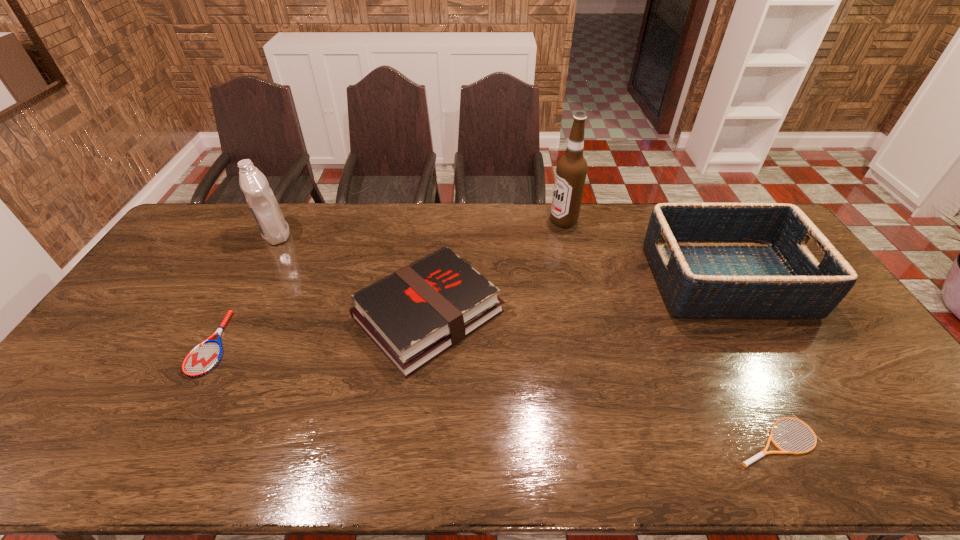
The width and height of the screenshot is (960, 540). In order to click on object present at the near edge in this screenshot , I will do `click(761, 454)`.

At what (x,y) coordinates should I click in order to perform the action: click on object that is positioned at the right edge. Please return your answer as a coordinate pair (x, y). Looking at the image, I should click on (711, 260).

This screenshot has width=960, height=540. Find the location of `free space at the far edge`. free space at the far edge is located at coordinates (297, 219).

The height and width of the screenshot is (540, 960). In the image, there is a desktop. Find the location of `vacant space at the near edge`. vacant space at the near edge is located at coordinates (270, 450).

I want to click on free region at the left edge of the desktop, so click(x=71, y=406).

This screenshot has width=960, height=540. In order to click on vacant space at the right edge in this screenshot , I will do `click(870, 370)`.

At what (x,y) coordinates should I click in order to perform the action: click on vacant space at the far left corner. Please return your answer as a coordinate pair (x, y). The height and width of the screenshot is (540, 960). Looking at the image, I should click on (231, 206).

You are a GUI agent. You are given a task and a screenshot of the screen. Output one action in this format:
    pyautogui.click(x=<x>, y=<y>)
    Task: Click on the free spot between the detergent and the tallest object
    This screenshot has width=960, height=540.
    Given the screenshot: What is the action you would take?
    pyautogui.click(x=420, y=228)

You are a GUI agent. You are given a task and a screenshot of the screen. Output one action in this format:
    pyautogui.click(x=<x>, y=<y>)
    Task: Click on the free point between the hardback book and the left tennis racket
    The height and width of the screenshot is (540, 960).
    Given the screenshot: What is the action you would take?
    pyautogui.click(x=321, y=329)

Find the location of a particular element. unoccupied area between the tallest object and the fourth tallest object is located at coordinates (496, 268).